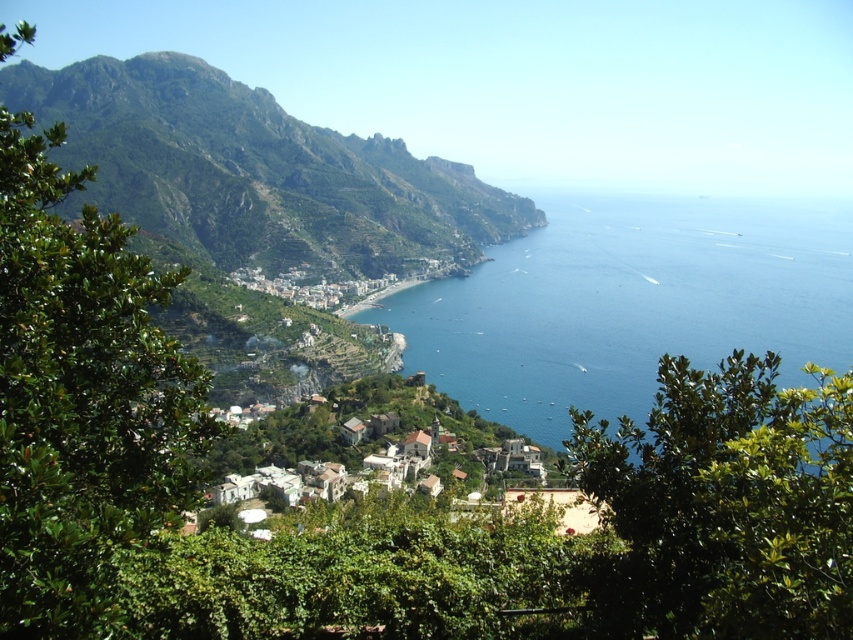
You are a drone operator tasked with capturing aerial footage of the coastal landscape. Your drone has a maximum flight range of 1000 feet from your current position. You need to fly it to both the blue liquid water at center and the green leafy tree at left. Can your drone successfully reach both locations without exceeding its range?

The blue liquid water at center and green leafy tree at left are 950.55 feet apart. Since the drone has a maximum flight range of 1000 feet, it can reach both locations as the distance between them is within the drone operator range.

Consider the image. You are standing at the viewpoint overlooking the Amalfi Coast scene. You notice a green leafy tree at lower right. Can you determine its exact position using the coordinate system provided?

The green leafy tree at lower right is located at point coordinates (726, 504).